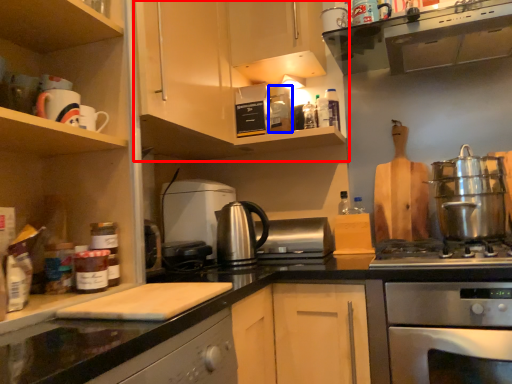
Question: Which object is further to the camera taking this photo, cabinetry (highlighted by a red box) or appliance (highlighted by a blue box)?

Choices:
 (A) cabinetry
 (B) appliance

Answer: (B)